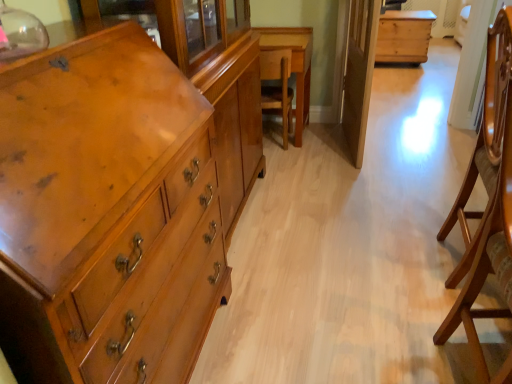
Question: From the image's perspective, does wooden table at center, which is the 1th table from bottom to top, appear higher than wooden armchair at right, positioned as the first armchair in right-to-left order?

Choices:
 (A) no
 (B) yes

Answer: (B)

Question: Considering the relative sizes of wooden table at center, the 2th table in the back-to-front sequence, and wooden armchair at right, positioned as the second armchair in left-to-right order, in the image provided, is wooden table at center, the 2th table in the back-to-front sequence, wider than wooden armchair at right, positioned as the second armchair in left-to-right order,?

Choices:
 (A) no
 (B) yes

Answer: (B)

Question: Can you confirm if wooden table at center, the 2th table in the back-to-front sequence, is positioned to the left of wooden armchair at right, positioned as the first armchair in right-to-left order?

Choices:
 (A) no
 (B) yes

Answer: (B)

Question: From the image's perspective, is wooden table at center, the first table from the front, located beneath wooden armchair at right, which is the second armchair in back-to-front order?

Choices:
 (A) yes
 (B) no

Answer: (B)

Question: Is wooden table at center, arranged as the 1th table when viewed from the left, behind wooden armchair at right, positioned as the first armchair in right-to-left order?

Choices:
 (A) no
 (B) yes

Answer: (B)

Question: In terms of height, does wooden chair at center, marked as the second armchair in a right-to-left arrangement, look taller or shorter compared to wooden table at center, the first table from the front?

Choices:
 (A) short
 (B) tall

Answer: (A)

Question: In terms of width, does wooden chair at center, the 1th armchair from the back, look wider or thinner when compared to wooden table at center, the first table from the front?

Choices:
 (A) wide
 (B) thin

Answer: (B)

Question: From a real-world perspective, is wooden chair at center, marked as the second armchair in a right-to-left arrangement, positioned above or below wooden table at center, the first table from the front?

Choices:
 (A) above
 (B) below

Answer: (B)

Question: Is point (261, 104) closer or farther from the camera than point (308, 102)?

Choices:
 (A) farther
 (B) closer

Answer: (B)

Question: In terms of width, does transparent glass door at center look wider or thinner when compared to wooden armchair at right, positioned as the second armchair in left-to-right order?

Choices:
 (A) thin
 (B) wide

Answer: (A)

Question: Based on their positions, is transparent glass door at center located to the left or right of wooden armchair at right, positioned as the second armchair in left-to-right order?

Choices:
 (A) right
 (B) left

Answer: (B)

Question: Relative to wooden armchair at right, positioned as the first armchair in right-to-left order, is transparent glass door at center in front or behind?

Choices:
 (A) behind
 (B) front

Answer: (A)

Question: From a real-world perspective, is transparent glass door at center physically located above or below wooden armchair at right, positioned as the first armchair in right-to-left order?

Choices:
 (A) below
 (B) above

Answer: (A)

Question: From the image's perspective, relative to wooden table at center, which is the 1th table from bottom to top, is natural wood chest at center, which is the 1th table from right to left, above or below?

Choices:
 (A) above
 (B) below

Answer: (A)

Question: From a real-world perspective, is natural wood chest at center, which is the 2th table in front-to-back order, positioned above or below wooden table at center, which is the 1th table from bottom to top?

Choices:
 (A) above
 (B) below

Answer: (B)